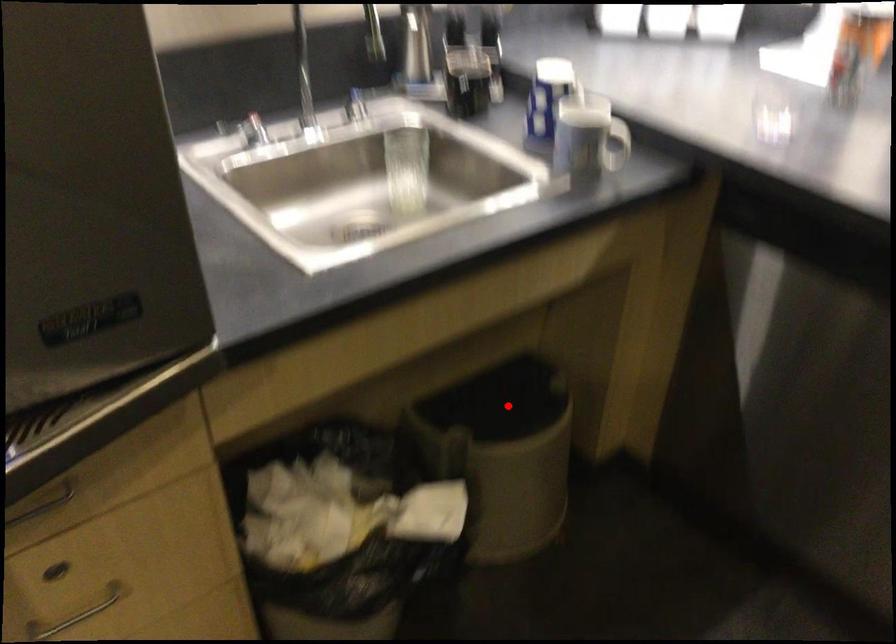
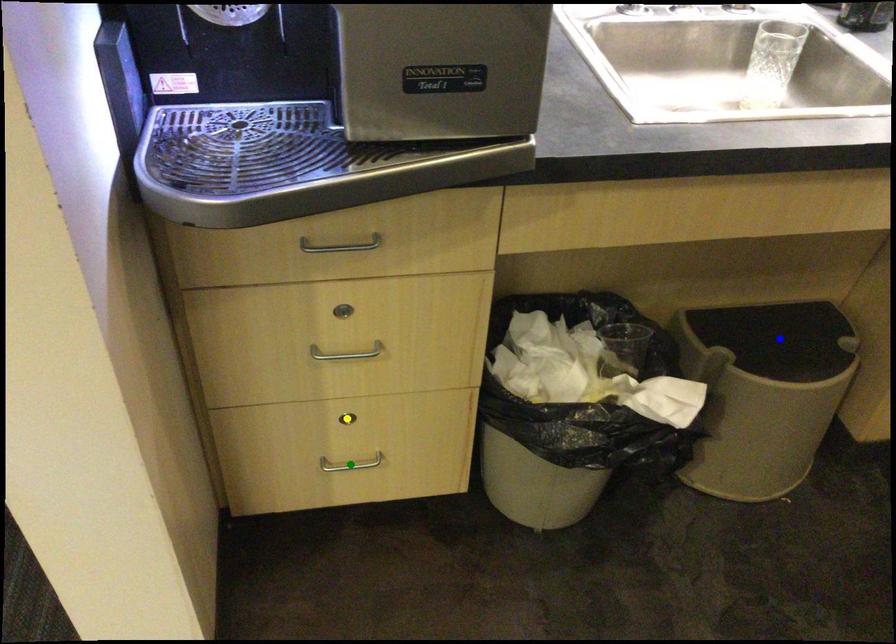
Question: I am providing you with two images of the same scene from different viewpoints. A red point is marked on the first image. You are given multiple points on the second image. Which point in image 2 represents the same 3d spot as the red point in image 1?

Choices:
 (A) blue point
 (B) green point
 (C) yellow point

Answer: (A)